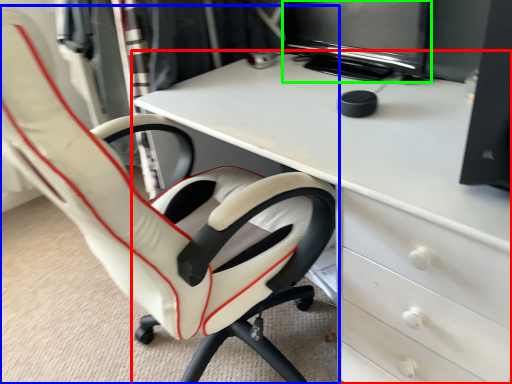
Question: Estimate the real-world distances between objects in this image. Which object is closer to desk (highlighted by a red box), chair (highlighted by a blue box) or computer monitor (highlighted by a green box)?

Choices:
 (A) chair
 (B) computer monitor

Answer: (A)